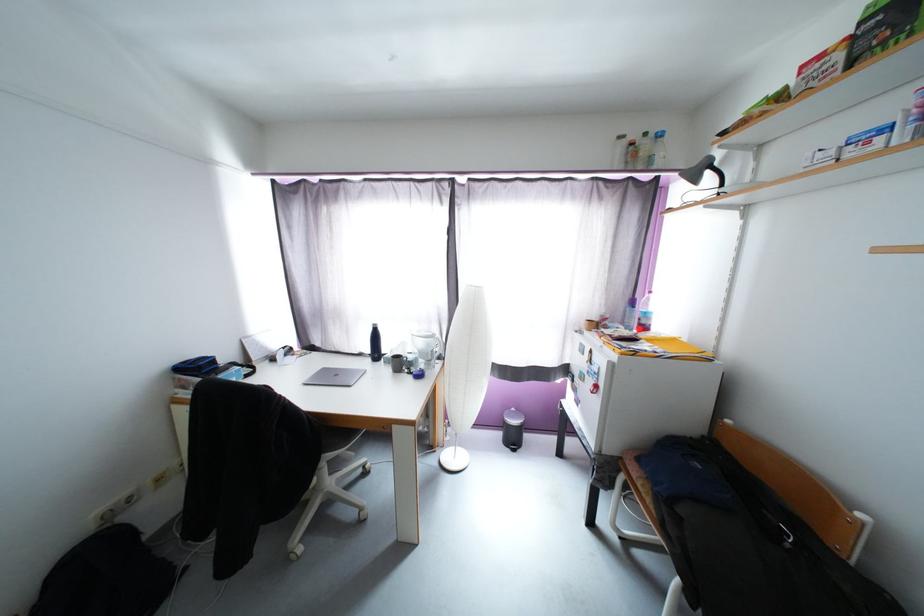
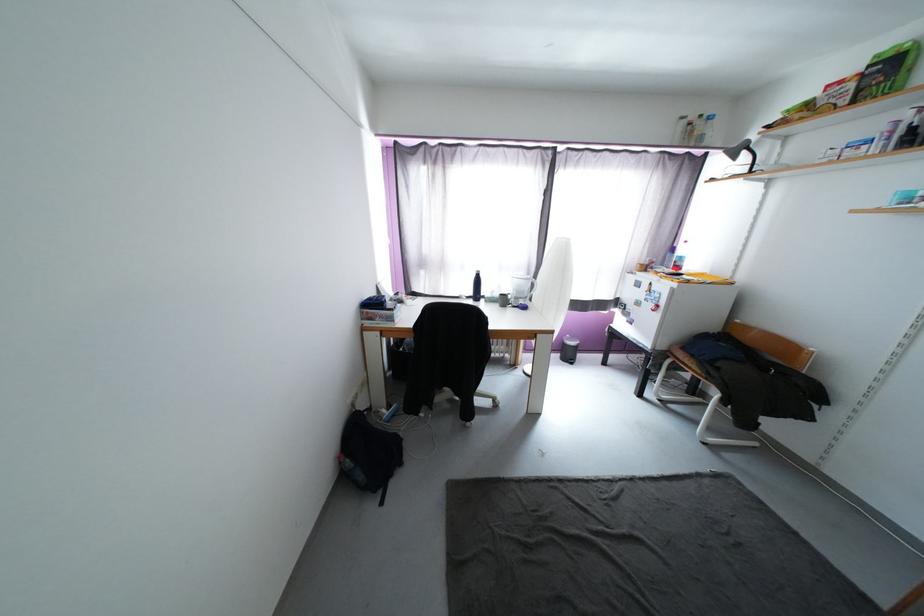
In the second image, find the point that corresponds to [377,331] in the first image.

(480, 277)